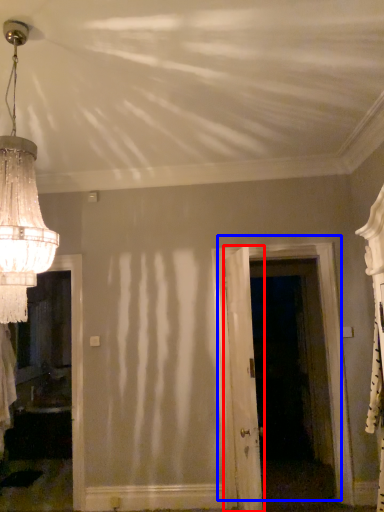
Question: Which of the following is the farthest to the observer, door (highlighted by a red box) or door (highlighted by a blue box)?

Choices:
 (A) door
 (B) door

Answer: (B)